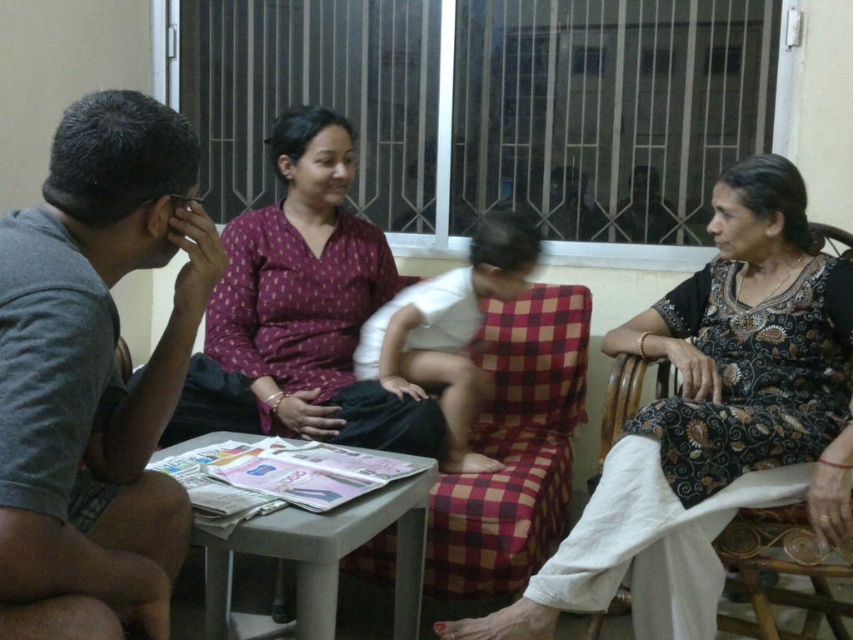
Does black printed dress at center have a greater height compared to white cotton baby at center?

Yes, black printed dress at center is taller than white cotton baby at center.

In the scene shown: Does black printed dress at center have a smaller size compared to white cotton baby at center?

Actually, black printed dress at center might be larger than white cotton baby at center.

Is point (776, 268) closer to camera compared to point (450, 419)?

Yes, point (776, 268) is in front of point (450, 419).

Find the location of `black printed dress at center`. black printed dress at center is located at coordinates (712, 422).

Based on the photo, is the position of black printed dress at center more distant than that of gray cotton shirt at left?

Yes, it is behind gray cotton shirt at left.

Can you confirm if black printed dress at center is positioned to the left of gray cotton shirt at left?

In fact, black printed dress at center is to the right of gray cotton shirt at left.

Does point (660, 520) come behind point (184, 516)?

Yes.

You are a GUI agent. You are given a task and a screenshot of the screen. Output one action in this format:
    pyautogui.click(x=<x>, y=<y>)
    Task: Click on the black printed dress at center
    The height and width of the screenshot is (640, 853).
    Given the screenshot: What is the action you would take?
    pyautogui.click(x=712, y=422)

Can you confirm if black printed dress at center is smaller than maroon printed kurta at center?

Actually, black printed dress at center might be larger than maroon printed kurta at center.

From the picture: Does black printed dress at center appear under maroon printed kurta at center?

Yes.

Who is more forward, (589, 611) or (332, 301)?

Point (589, 611) is in front.

This screenshot has height=640, width=853. In order to click on black printed dress at center in this screenshot , I will do `click(712, 422)`.